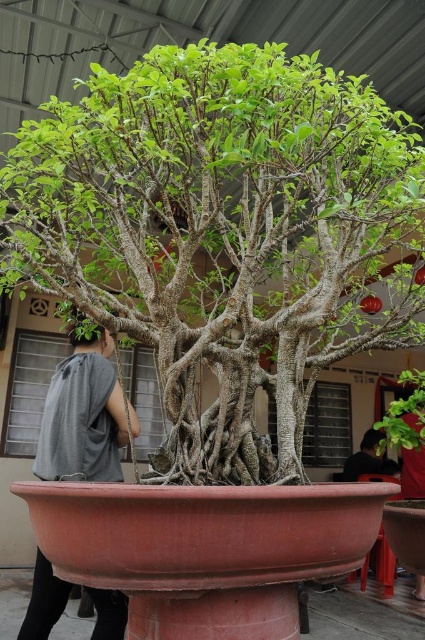
Question: Does gray cotton shirt at left have a greater width compared to green matte plant at center?

Choices:
 (A) no
 (B) yes

Answer: (B)

Question: Which object appears farthest from the camera in this image?

Choices:
 (A) gray cotton shirt at left
 (B) green textured bonsai at center

Answer: (A)

Question: In this image, where is green textured bonsai at center located relative to gray cotton shirt at left?

Choices:
 (A) right
 (B) left

Answer: (A)

Question: Is gray cotton shirt at left closer to camera compared to green matte plant at center?

Choices:
 (A) no
 (B) yes

Answer: (A)

Question: Which object is the farthest from the green textured bonsai at center?

Choices:
 (A) green matte plant at center
 (B) gray cotton shirt at left

Answer: (A)

Question: Which of the following is the closest to the observer?

Choices:
 (A) gray cotton shirt at left
 (B) green textured bonsai at center

Answer: (B)